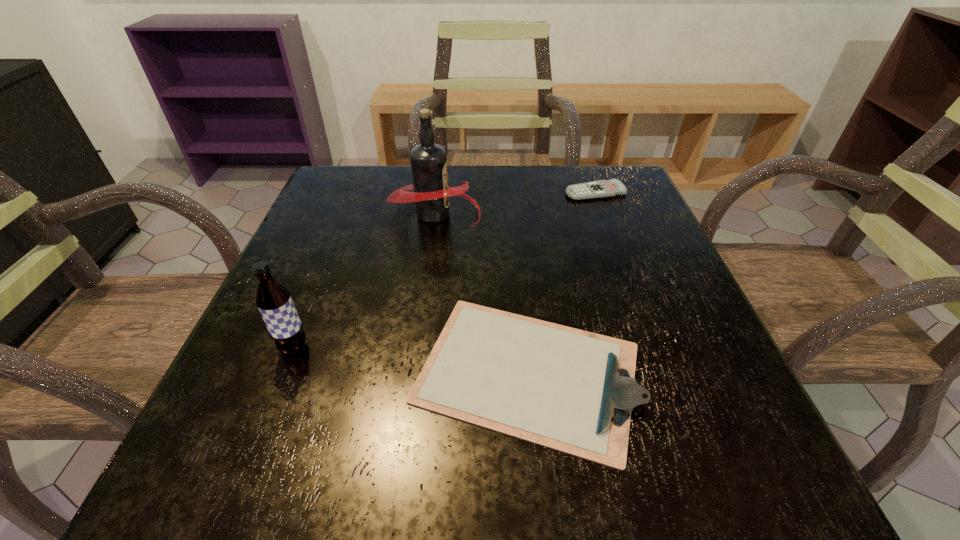
Where is `unoccupied position between the right root beer and the clipboard`? This screenshot has width=960, height=540. unoccupied position between the right root beer and the clipboard is located at coordinates (481, 293).

Image resolution: width=960 pixels, height=540 pixels. Identify the location of free space between the taller root beer and the remote control. (515, 203).

Find the location of `empty space that is in between the clipboard and the right root beer`. empty space that is in between the clipboard and the right root beer is located at coordinates (481, 293).

The width and height of the screenshot is (960, 540). Identify the location of vacant point located between the shorter root beer and the third tallest object. (411, 360).

You are a GUI agent. You are given a task and a screenshot of the screen. Output one action in this format:
    pyautogui.click(x=<x>, y=<y>)
    Task: Click on the free spot between the left root beer and the remote control
    
    Given the screenshot: What is the action you would take?
    pyautogui.click(x=444, y=271)

Image resolution: width=960 pixels, height=540 pixels. Identify the location of object identified as the third closest to the right root beer. (273, 299).

Choose which object is the nearest neighbor to the remote control. Please provide its 2D coordinates. Your answer should be formatted as a tuple, i.e. [(x, y)], where the tuple contains the x and y coordinates of a point satisfying the conditions above.

[(431, 194)]

Where is `free location that satisfies the following two spatial constraints: 1. on the back side of the leftmost object; 2. on the right side of the remote control`? The width and height of the screenshot is (960, 540). free location that satisfies the following two spatial constraints: 1. on the back side of the leftmost object; 2. on the right side of the remote control is located at coordinates (356, 192).

Locate an element on the screen. vacant space that satisfies the following two spatial constraints: 1. on the back side of the left root beer; 2. on the right side of the shortest object is located at coordinates (356, 192).

At what (x,y) coordinates should I click in order to perform the action: click on vacant position in the image that satisfies the following two spatial constraints: 1. on the label of the clipboard; 2. on the left side of the right root beer. Please return your answer as a coordinate pair (x, y). This screenshot has height=540, width=960. Looking at the image, I should click on 413,373.